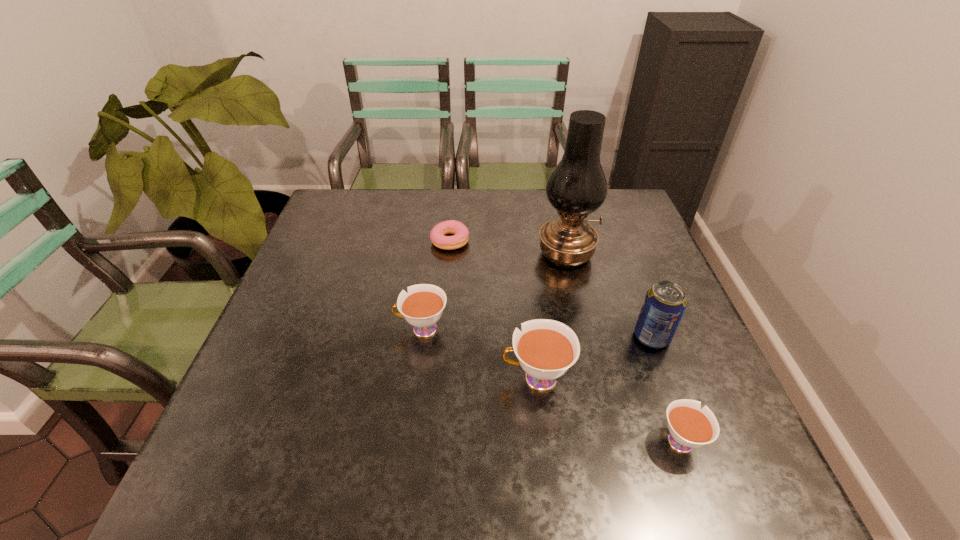
The image size is (960, 540). Identify the location of vacant area situated on the side of the leftmost teacup with the handle. (318, 329).

In order to click on free region located 0.140m on the side of the leftmost teacup with the handle in this screenshot , I will do `click(335, 329)`.

This screenshot has width=960, height=540. What are the coordinates of `blank area located on the side of the second nearest teacup with the handle` in the screenshot? It's located at (369, 378).

Identify the location of vacant space located 0.330m on the side of the second nearest teacup with the handle. (345, 378).

The height and width of the screenshot is (540, 960). Identify the location of vacant region located on the side of the second nearest teacup with the handle. (335, 378).

This screenshot has width=960, height=540. I want to click on free region located 0.140m on the side of the fifth tallest object with the handle, so click(650, 357).

At what (x,y) coordinates should I click in order to perform the action: click on vacant region located on the side of the fifth tallest object with the handle. Please return your answer as a coordinate pair (x, y). The width and height of the screenshot is (960, 540). Looking at the image, I should click on (630, 300).

Locate an element on the screen. The height and width of the screenshot is (540, 960). vacant space located 0.390m on the side of the fifth tallest object with the handle is located at coordinates (623, 281).

Identify the location of blank area located 0.110m on the front of the tallest object. (577, 302).

Find the location of a particular element. The width and height of the screenshot is (960, 540). vacant region located 0.330m on the right of the shortest object is located at coordinates (583, 241).